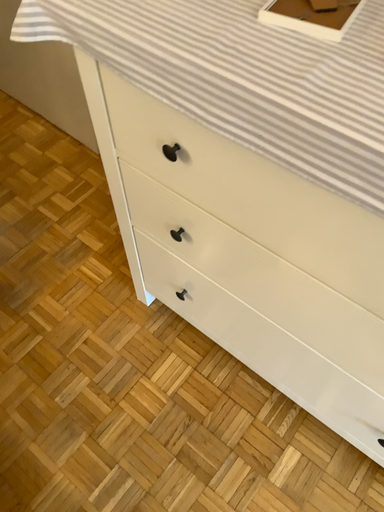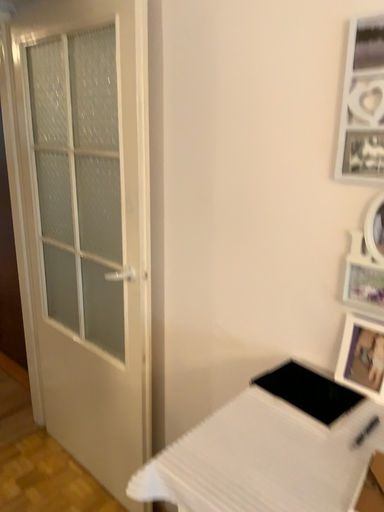
Question: How did the camera likely rotate when shooting the video?

Choices:
 (A) rotated upward
 (B) rotated downward

Answer: (A)